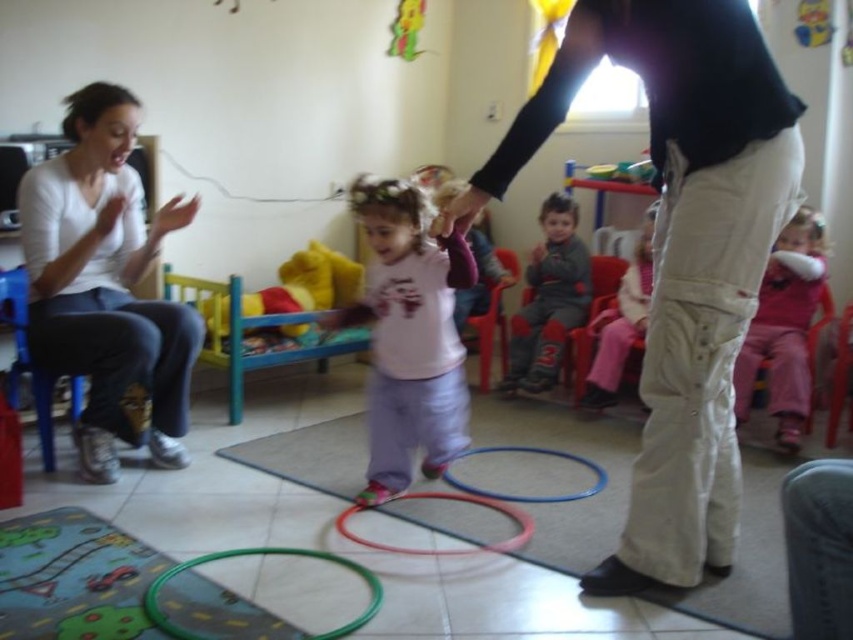
Between pink cotton shirt at center and translucent plastic hoop at center, which one appears on the right side from the viewer's perspective?

From the viewer's perspective, translucent plastic hoop at center appears more on the right side.

Is point (363, 298) less distant than point (569, 452)?

That is False.

In order to click on pink cotton shirt at center in this screenshot , I will do `click(408, 336)`.

Is khaki cotton pants at center further to camera compared to yellow plush bear at center?

No, it is in front of yellow plush bear at center.

Which is more to the right, khaki cotton pants at center or yellow plush bear at center?

khaki cotton pants at center

Does point (686, 532) come in front of point (280, 326)?

Yes, it is in front of point (280, 326).

Locate an element on the screen. This screenshot has height=640, width=853. khaki cotton pants at center is located at coordinates click(x=680, y=253).

Does khaki cotton pants at center appear under translucent plastic hoop at center?

Actually, khaki cotton pants at center is above translucent plastic hoop at center.

Does khaki cotton pants at center have a greater width compared to translucent plastic hoop at center?

Indeed, khaki cotton pants at center has a greater width compared to translucent plastic hoop at center.

Image resolution: width=853 pixels, height=640 pixels. What are the coordinates of `khaki cotton pants at center` in the screenshot? It's located at (680, 253).